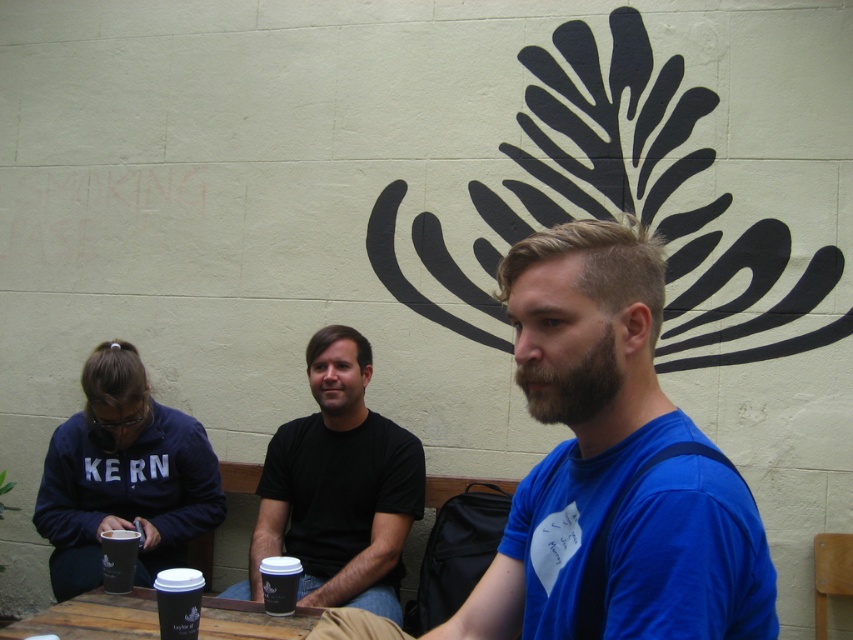
You are a photographer who needs to take a closeup shot of the black paper cup at lower left. The camera you are using has a minimum focusing distance of 6 feet. Can you take the photo without moving either the camera or the cup?

The black paper cup at lower left and camera are 5.92 feet apart, so yes, the photographer can take the closeup shot without moving either since the distance is within the camera minimum focusing distance of 6 feet.

You are a barista who needs to deliver two cups to a customer seated at the wooden table. The customer has requested that the distance between the two cups should not exceed 12 inches to prevent spills. Can you place the black paper cup at lower left and the matte black cup at lower left in a way that meets the customer

The black paper cup at lower left and matte black cup at lower left are 16.32 inches apart from each other, which exceeds the customer